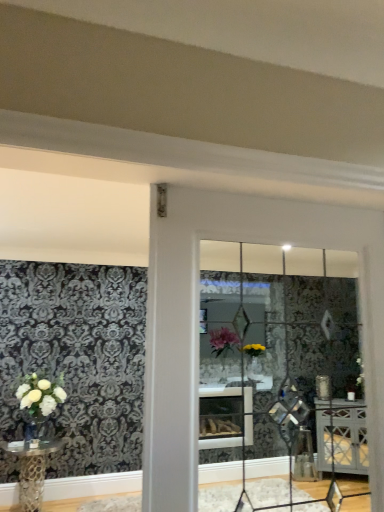
Question: Based on their positions, is white matte vase at left located to the left or right of metallic gold table at lower left?

Choices:
 (A) right
 (B) left

Answer: (A)

Question: In the image, is white matte vase at left positioned in front of or behind metallic gold table at lower left?

Choices:
 (A) front
 (B) behind

Answer: (B)

Question: Based on their relative distances, which object is farther from the metallic gold table at lower left?

Choices:
 (A) white matte vase at left
 (B) clear glass door at center
 (C) clear glass vase at lower left

Answer: (B)

Question: Estimate the real-world distances between objects in this image. Which object is closer to the white matte vase at left?

Choices:
 (A) metallic gold table at lower left
 (B) clear glass door at center
 (C) clear glass vase at lower left

Answer: (C)